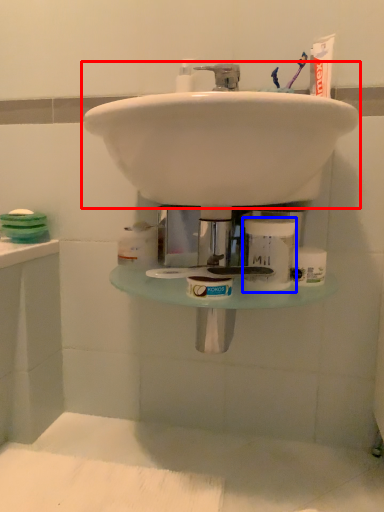
Question: Which object appears farthest to the camera in this image, sink (highlighted by a red box) or toiletry (highlighted by a blue box)?

Choices:
 (A) sink
 (B) toiletry

Answer: (B)